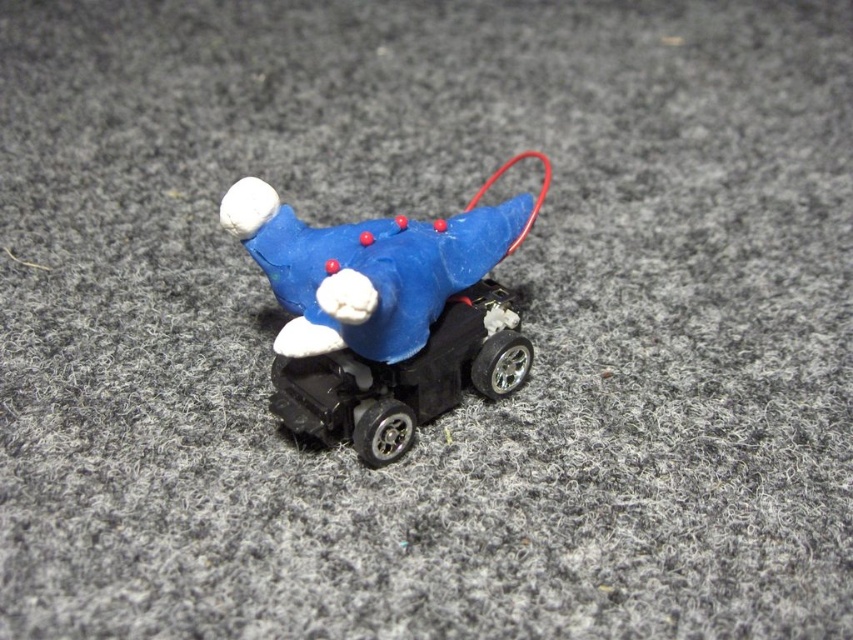
Question: From the image, what is the correct spatial relationship of blue matte/black plastic toy at center in relation to black plastic car at center?

Choices:
 (A) below
 (B) above

Answer: (B)

Question: Is blue matte/black plastic toy at center bigger than black plastic car at center?

Choices:
 (A) yes
 (B) no

Answer: (A)

Question: Among these points, which one is farthest from the camera?

Choices:
 (A) (404, 360)
 (B) (282, 272)

Answer: (A)

Question: Does blue matte/black plastic toy at center have a smaller size compared to black plastic car at center?

Choices:
 (A) yes
 (B) no

Answer: (B)

Question: Which point is closer to the camera taking this photo?

Choices:
 (A) (376, 333)
 (B) (497, 362)

Answer: (A)

Question: Which point is closer to the camera?

Choices:
 (A) blue matte/black plastic toy at center
 (B) black plastic car at center

Answer: (A)